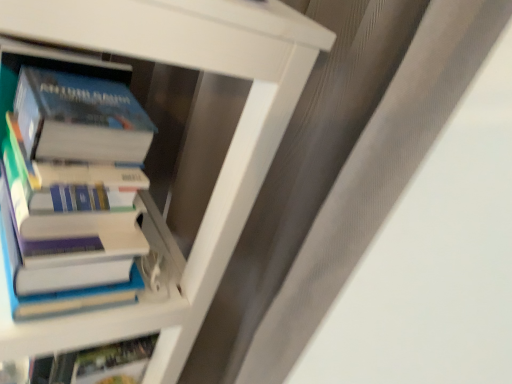
Question: Is hardcover book at left, arranged as the 1th book when ordered from the bottom, inside or outside of hardcover books at left, which is the 1th book in top-to-bottom order?

Choices:
 (A) inside
 (B) outside

Answer: (B)

Question: From a real-world perspective, relative to hardcover books at left, the 2th book when ordered from bottom to top, is hardcover book at left, arranged as the 1th book when ordered from the bottom, vertically above or below?

Choices:
 (A) above
 (B) below

Answer: (B)

Question: Is hardcover book at left, acting as the 2th book starting from the top, bigger or smaller than hardcover books at left, the 2th book when ordered from bottom to top?

Choices:
 (A) small
 (B) big

Answer: (B)

Question: Is hardcover books at left, which is the 1th book in top-to-bottom order, to the left or to the right of hardcover book at left, acting as the 2th book starting from the top, in the image?

Choices:
 (A) right
 (B) left

Answer: (A)

Question: Is point (109, 223) positioned closer to the camera than point (79, 314)?

Choices:
 (A) closer
 (B) farther

Answer: (A)

Question: Considering the positions of hardcover books at left, the 2th book when ordered from bottom to top, and hardcover book at left, acting as the 2th book starting from the top, in the image, is hardcover books at left, the 2th book when ordered from bottom to top, bigger or smaller than hardcover book at left, acting as the 2th book starting from the top,?

Choices:
 (A) small
 (B) big

Answer: (A)

Question: Considering the positions of hardcover books at left, which is the 1th book in top-to-bottom order, and hardcover book at left, arranged as the 1th book when ordered from the bottom, in the image, is hardcover books at left, which is the 1th book in top-to-bottom order, wider or thinner than hardcover book at left, arranged as the 1th book when ordered from the bottom,?

Choices:
 (A) wide
 (B) thin

Answer: (B)